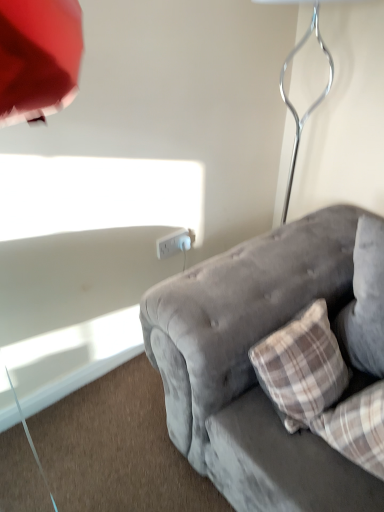
Question: Does metallic silver table lamp at upper right have a lesser width compared to velvet gray couch at lower right?

Choices:
 (A) yes
 (B) no

Answer: (A)

Question: From the image's perspective, is metallic silver table lamp at upper right on velvet gray couch at lower right?

Choices:
 (A) no
 (B) yes

Answer: (B)

Question: Does metallic silver table lamp at upper right have a greater height compared to velvet gray couch at lower right?

Choices:
 (A) no
 (B) yes

Answer: (B)

Question: Is metallic silver table lamp at upper right to the right of velvet gray couch at lower right from the viewer's perspective?

Choices:
 (A) yes
 (B) no

Answer: (B)

Question: Is metallic silver table lamp at upper right oriented towards velvet gray couch at lower right?

Choices:
 (A) yes
 (B) no

Answer: (A)

Question: From the image's perspective, is metallic silver table lamp at upper right beneath velvet gray couch at lower right?

Choices:
 (A) yes
 (B) no

Answer: (B)

Question: Considering the relative sizes of metallic silver table lamp at upper right and white plastic power outlet at center in the image provided, is metallic silver table lamp at upper right shorter than white plastic power outlet at center?

Choices:
 (A) no
 (B) yes

Answer: (A)

Question: From the image's perspective, is metallic silver table lamp at upper right over white plastic power outlet at center?

Choices:
 (A) no
 (B) yes

Answer: (B)

Question: Considering the relative sizes of metallic silver table lamp at upper right and white plastic power outlet at center in the image provided, is metallic silver table lamp at upper right taller than white plastic power outlet at center?

Choices:
 (A) no
 (B) yes

Answer: (B)

Question: Does metallic silver table lamp at upper right have a smaller size compared to white plastic power outlet at center?

Choices:
 (A) yes
 (B) no

Answer: (B)

Question: Can you confirm if metallic silver table lamp at upper right is positioned to the left of white plastic power outlet at center?

Choices:
 (A) yes
 (B) no

Answer: (B)

Question: From a real-world perspective, is metallic silver table lamp at upper right positioned under white plastic power outlet at center based on gravity?

Choices:
 (A) yes
 (B) no

Answer: (B)

Question: Is the depth of white plastic power outlet at center greater than that of metallic silver table lamp at upper right?

Choices:
 (A) no
 (B) yes

Answer: (B)